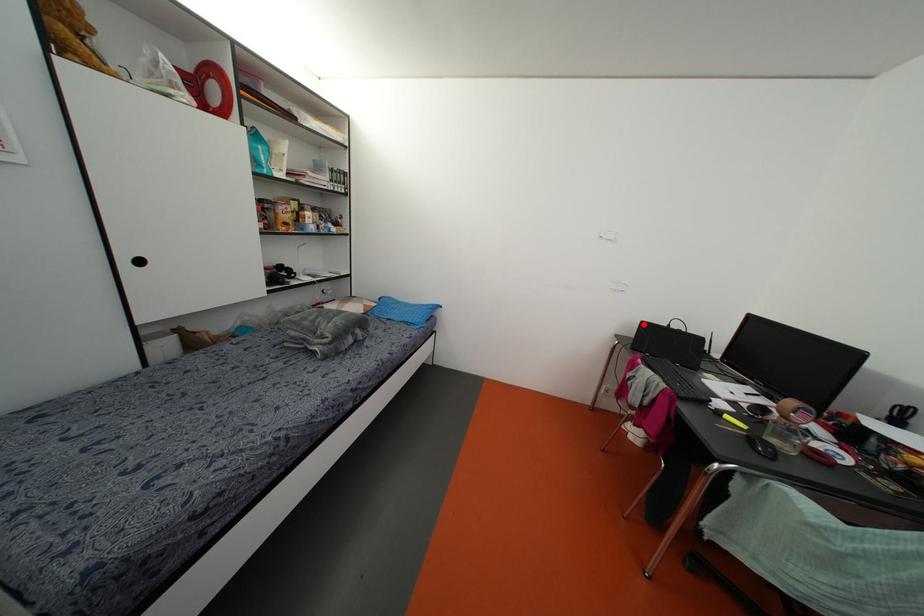
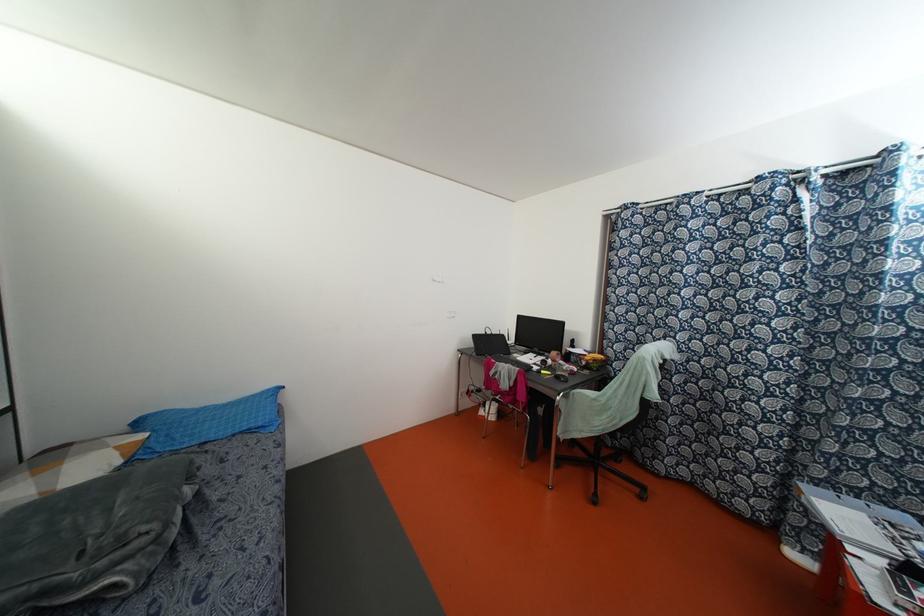
Question: I am providing you with two images of the same scene from different viewpoints. A red point is marked on the first image. At the location where the point appears in image 1, is it still visible in image 2?

Choices:
 (A) Yes
 (B) No

Answer: (A)